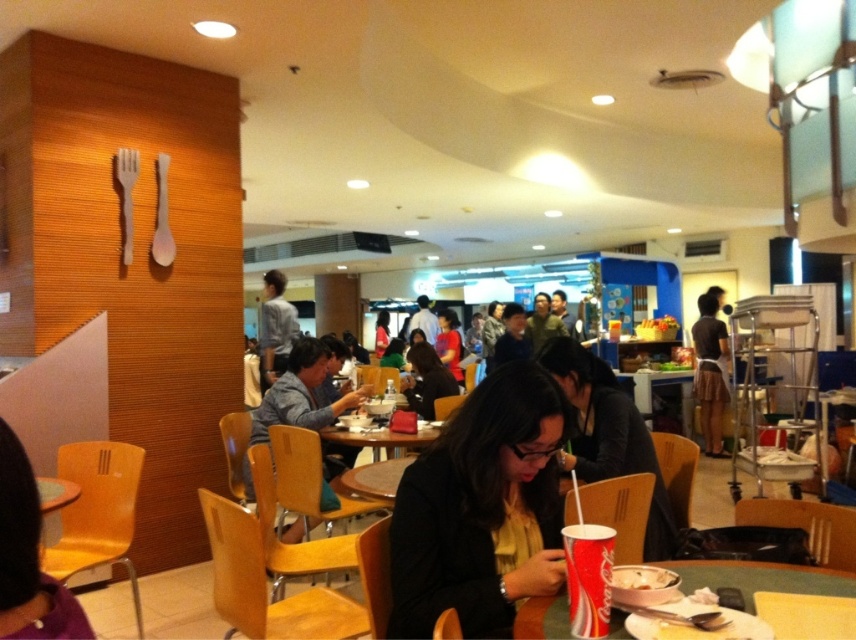
What object is located at the coordinates point (761, 577)?

The point (761, 577) marks the location of the matte plastic table at center.

You are a food court employee who needs to place a new menu board between the matte black jacket at center and the matte red cup at lower center. Which object should you position closer to the center of the area to ensure the menu board fits properly?

The matte black jacket at center might be wider than the matte red cup at lower center, so positioning the menu board closer to the matte red cup at lower center would allow for better spacing and ensure the board fits without obstruction.

You are a customer holding a white paper cup at center and want to place it on the wooden table at center. Can you fit the cup on the table?

The wooden table at center might be wider than white paper cup at center, so there is a possibility that the cup can be placed on the table, but the exact dimensions are uncertain.